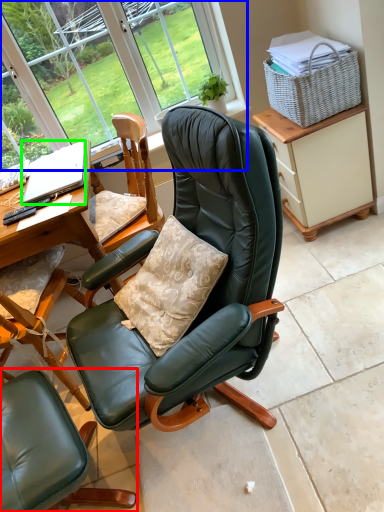
Question: Based on their relative distances, which object is farther from chair (highlighted by a red box)? Choose from bay window (highlighted by a blue box) and laptop (highlighted by a green box).

Choices:
 (A) bay window
 (B) laptop

Answer: (A)